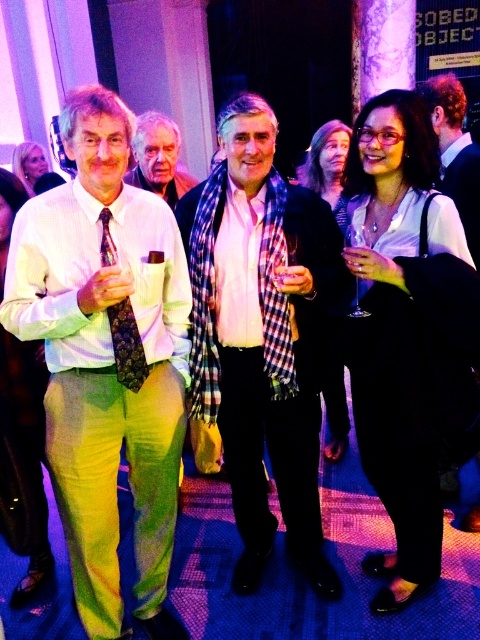
You are at a party and want to take a photo of the plaid scarf at center and the dark purple floral tie at left. Which one should you zoom in on to capture more details?

The plaid scarf at center is much taller than the dark purple floral tie at left, so you should zoom in on the plaid scarf at center to capture more details.

From the picture: You are at a social event and notice two people in the crowd. One is wearing a white striped shirt at left and another has a plaid scarf at center. If you want to approach the person who is closer to you, which one should you head towards?

The white striped shirt at left is in front of the plaid scarf at center, so the person wearing the white striped shirt at left is closer to you and should be approached first.

You are at a social event and see the white striped shirt at left and the dark purple floral tie at left. Which one is nearer to you?

The white striped shirt at left is closer to the viewer than the dark purple floral tie at left.